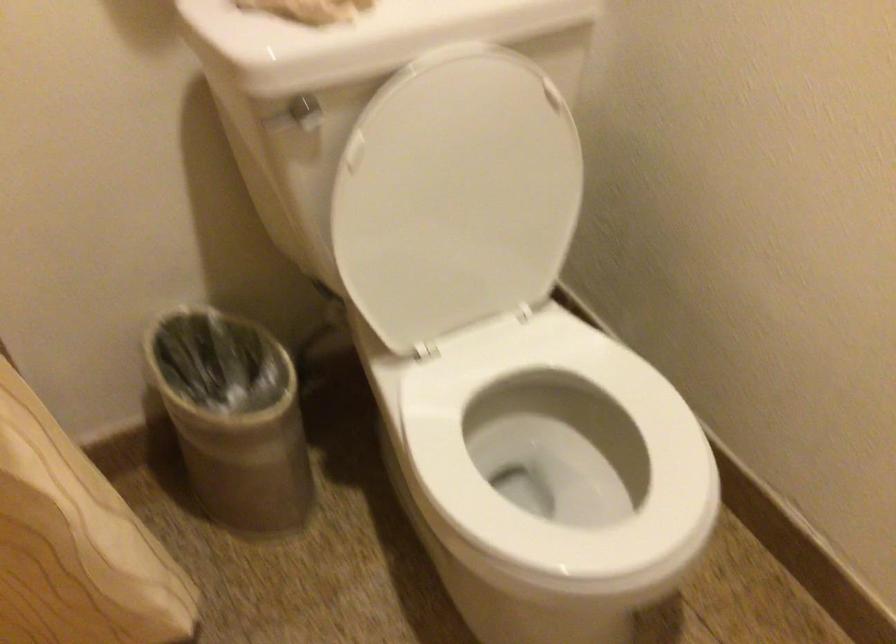
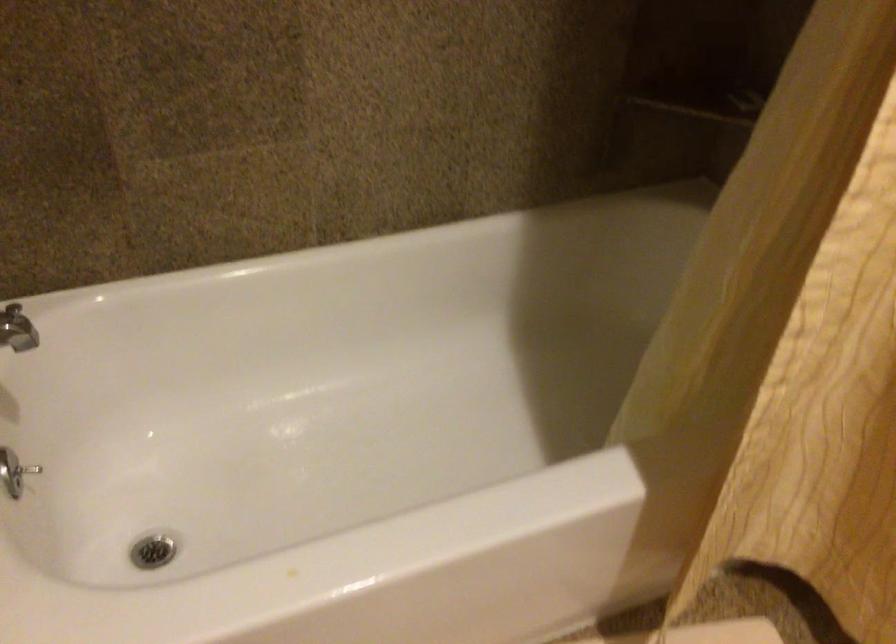
The first image is from the beginning of the video and the second image is from the end. How did the camera likely rotate when shooting the video?

The rotation direction of the camera is left-down.